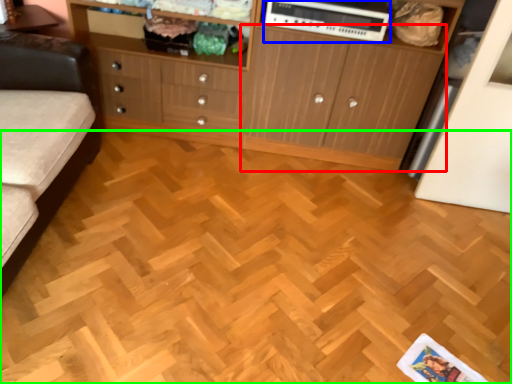
Question: Which object is positioned farthest from cupboard (highlighted by a red box)? Select from appliance (highlighted by a blue box) and plywood (highlighted by a green box).

Choices:
 (A) appliance
 (B) plywood

Answer: (B)